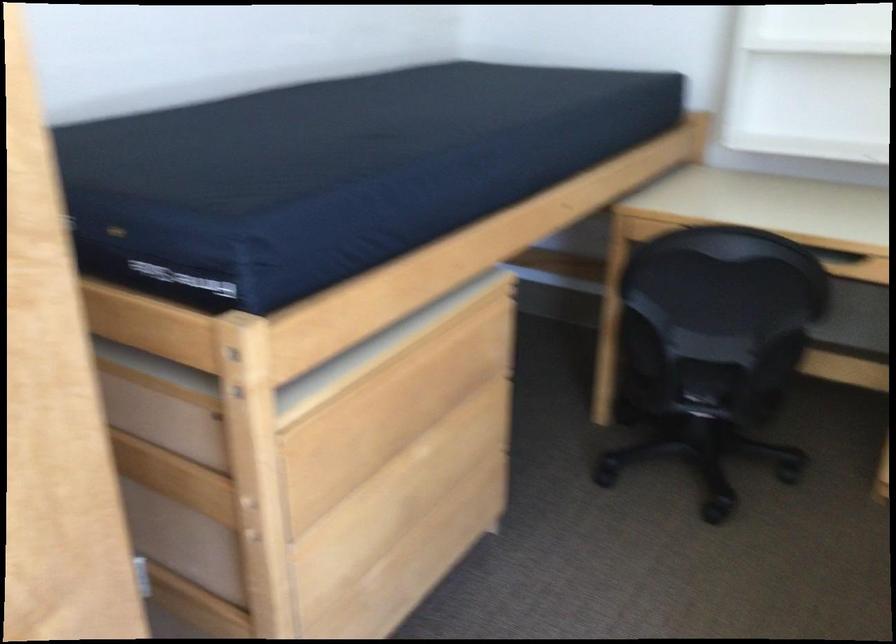
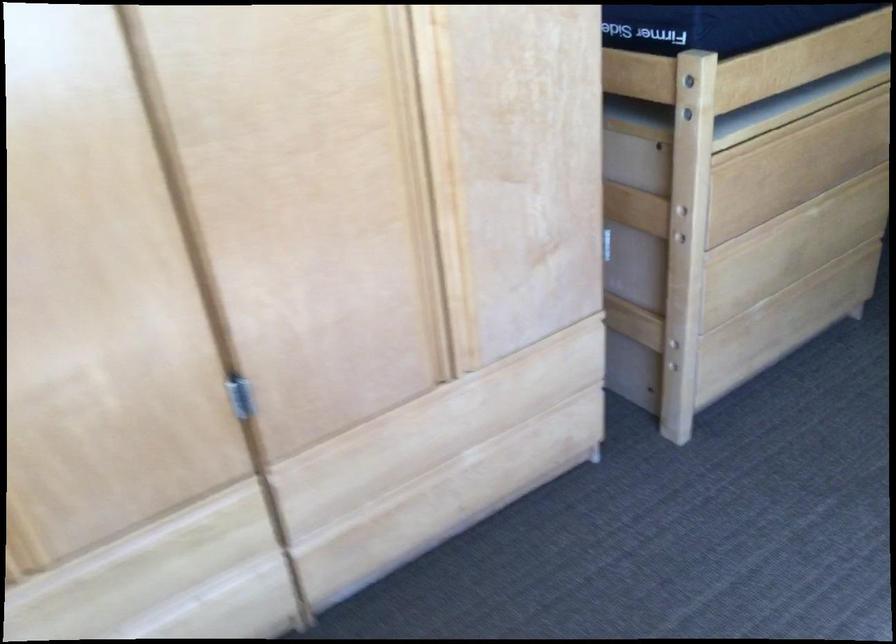
Where in the second image is the point corresponding to (261,544) from the first image?

(682, 240)